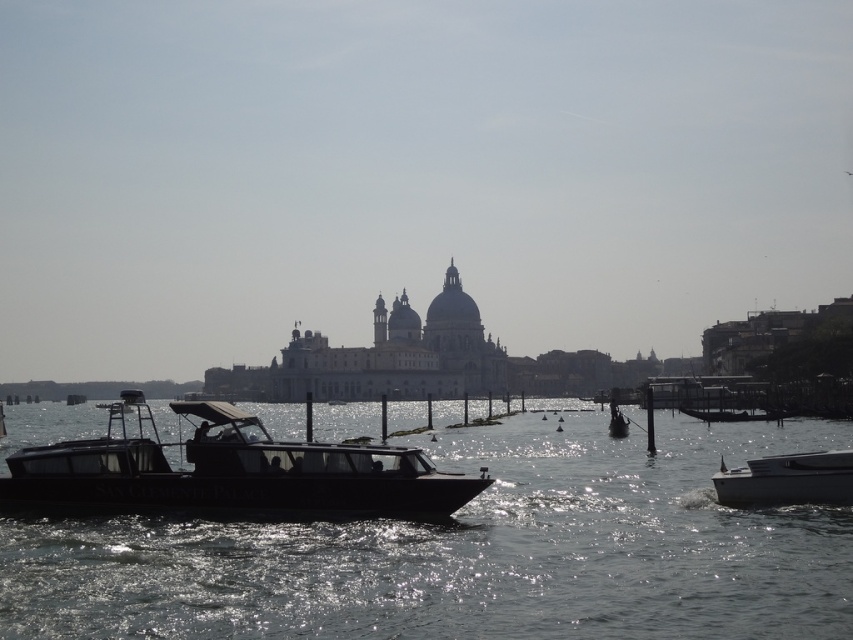
Question: Which object appears closest to the camera in this image?

Choices:
 (A) transparent water at center
 (B) white glossy boat at right
 (C) black matte boat at center

Answer: (A)

Question: From the image, what is the correct spatial relationship of transparent water at center in relation to black matte boat at center?

Choices:
 (A) right
 (B) left

Answer: (B)

Question: Which point is farther from the camera taking this photo?

Choices:
 (A) (451, 444)
 (B) (102, 504)

Answer: (A)

Question: Which object is the farthest from the white glossy boat at right?

Choices:
 (A) black matte boat at center
 (B) transparent water at center

Answer: (B)

Question: Can you confirm if transparent water at center is positioned below black matte boat at center?

Choices:
 (A) no
 (B) yes

Answer: (A)

Question: Is transparent water at center smaller than black matte boat at center?

Choices:
 (A) no
 (B) yes

Answer: (A)